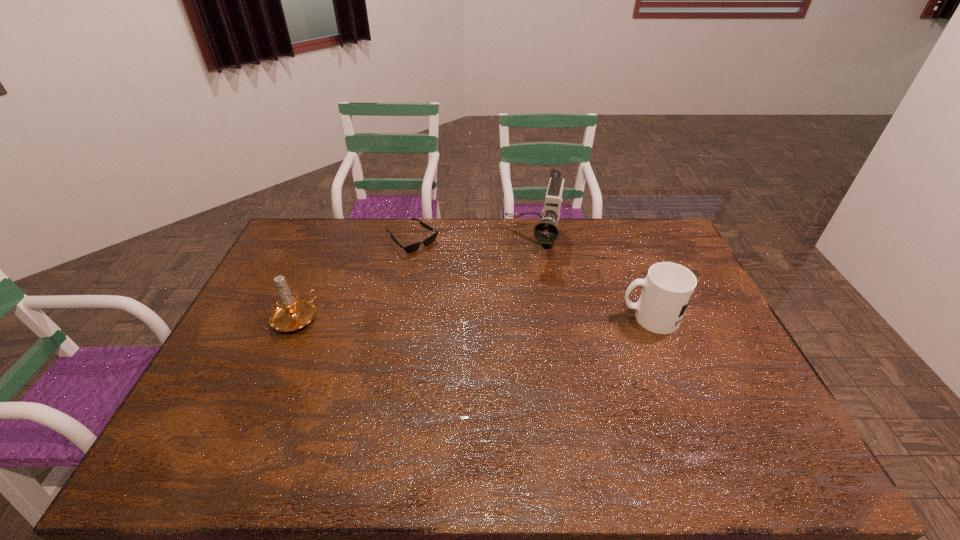
Where is `candle`? The image size is (960, 540). candle is located at coordinates (291, 313).

The width and height of the screenshot is (960, 540). I want to click on mug, so click(667, 289).

Image resolution: width=960 pixels, height=540 pixels. I want to click on camcorder, so click(546, 232).

The image size is (960, 540). In order to click on the tallest object in this screenshot , I will do `click(546, 232)`.

Where is `the third object from right to left`? the third object from right to left is located at coordinates (413, 247).

You are a GUI agent. You are given a task and a screenshot of the screen. Output one action in this format:
    pyautogui.click(x=<x>, y=<y>)
    Task: Click on the sunglasses
    
    Given the screenshot: What is the action you would take?
    pyautogui.click(x=413, y=247)

Where is `free space located 0.290m on the right of the candle`? The image size is (960, 540). free space located 0.290m on the right of the candle is located at coordinates (413, 318).

The height and width of the screenshot is (540, 960). In order to click on free location located 0.280m on the handle side of the mug in this screenshot , I will do `click(529, 318)`.

This screenshot has width=960, height=540. Find the location of `blank space located 0.090m on the handle side of the mug`. blank space located 0.090m on the handle side of the mug is located at coordinates (591, 318).

Find the location of a particular element. This screenshot has height=540, width=960. free region located on the handle side of the mug is located at coordinates (605, 318).